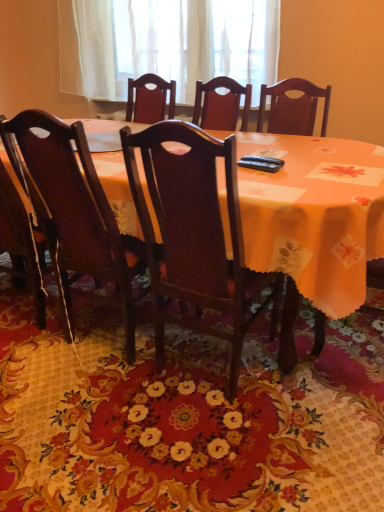
Where is `free space that is in between wooden chair at center, the second chair in the right-to-left sequence, and dark wood chair at center, the second chair from the left`? The image size is (384, 512). free space that is in between wooden chair at center, the second chair in the right-to-left sequence, and dark wood chair at center, the second chair from the left is located at coordinates (159, 357).